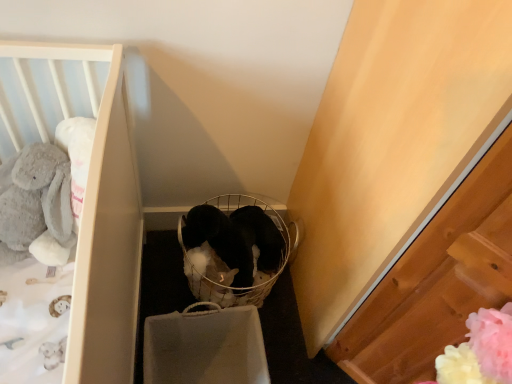
Question: Is black plush baby carriage at center positioned beyond the bounds of soft gray plush rabbit at left?

Choices:
 (A) yes
 (B) no

Answer: (A)

Question: Is black plush baby carriage at center positioned with its back to soft gray plush rabbit at left?

Choices:
 (A) yes
 (B) no

Answer: (B)

Question: From a real-world perspective, does black plush baby carriage at center stand above soft gray plush rabbit at left?

Choices:
 (A) yes
 (B) no

Answer: (B)

Question: From the image's perspective, is black plush baby carriage at center over soft gray plush rabbit at left?

Choices:
 (A) yes
 (B) no

Answer: (B)

Question: From a real-world perspective, is black plush baby carriage at center under soft gray plush rabbit at left?

Choices:
 (A) no
 (B) yes

Answer: (B)

Question: From a real-world perspective, is white crib at left physically located above or below soft gray plush rabbit at left?

Choices:
 (A) above
 (B) below

Answer: (A)

Question: Considering the positions of point (34, 94) and point (10, 193), is point (34, 94) closer or farther from the camera than point (10, 193)?

Choices:
 (A) closer
 (B) farther

Answer: (A)

Question: Is white crib at left taller or shorter than soft gray plush rabbit at left?

Choices:
 (A) short
 (B) tall

Answer: (A)

Question: From the image's perspective, is white crib at left positioned above or below soft gray plush rabbit at left?

Choices:
 (A) above
 (B) below

Answer: (B)

Question: From the image's perspective, relative to soft gray plush rabbit at left, is black plush baby carriage at center above or below?

Choices:
 (A) below
 (B) above

Answer: (A)

Question: Is black plush baby carriage at center bigger or smaller than soft gray plush rabbit at left?

Choices:
 (A) big
 (B) small

Answer: (A)

Question: Is point (274, 276) positioned closer to the camera than point (61, 195)?

Choices:
 (A) closer
 (B) farther

Answer: (B)

Question: Is black plush baby carriage at center in front of or behind soft gray plush rabbit at left in the image?

Choices:
 (A) behind
 (B) front

Answer: (A)

Question: Is white crib at left inside or outside of black plush baby carriage at center?

Choices:
 (A) inside
 (B) outside

Answer: (B)

Question: In terms of size, does white crib at left appear bigger or smaller than black plush baby carriage at center?

Choices:
 (A) small
 (B) big

Answer: (A)